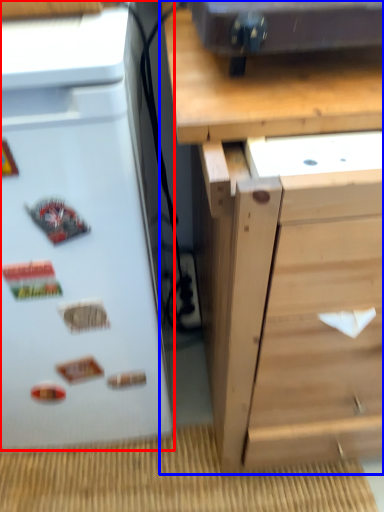
Question: Which of the following is the closest to the observer, refrigerator (highlighted by a red box) or chest of drawers (highlighted by a blue box)?

Choices:
 (A) refrigerator
 (B) chest of drawers

Answer: (B)